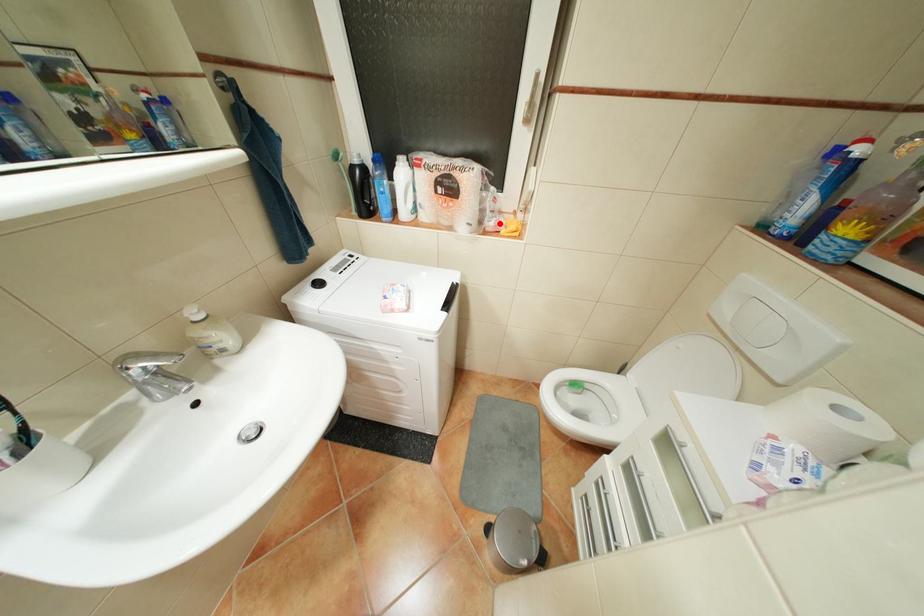
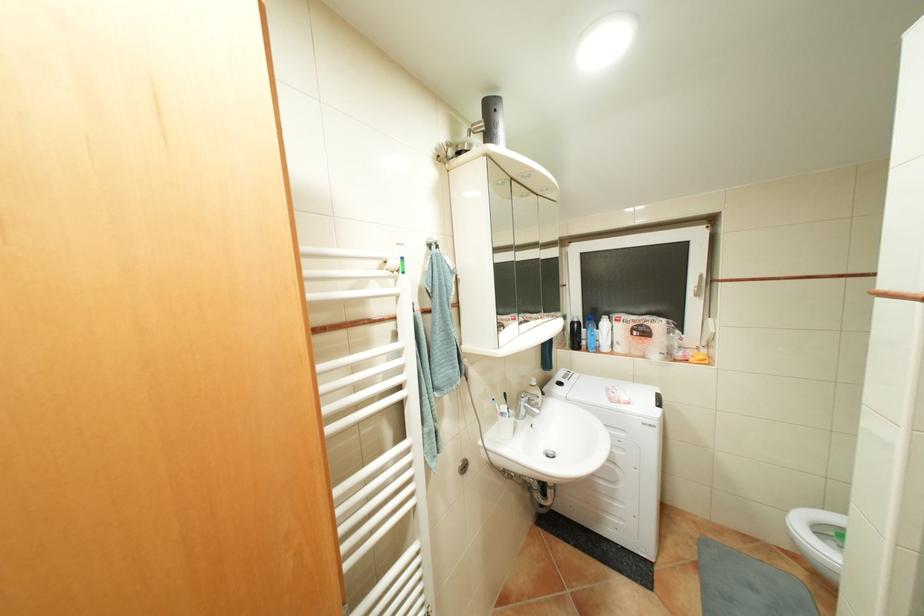
The point at the highlighted location is marked in the first image. Where is the corresponding point in the second image?

(688, 354)